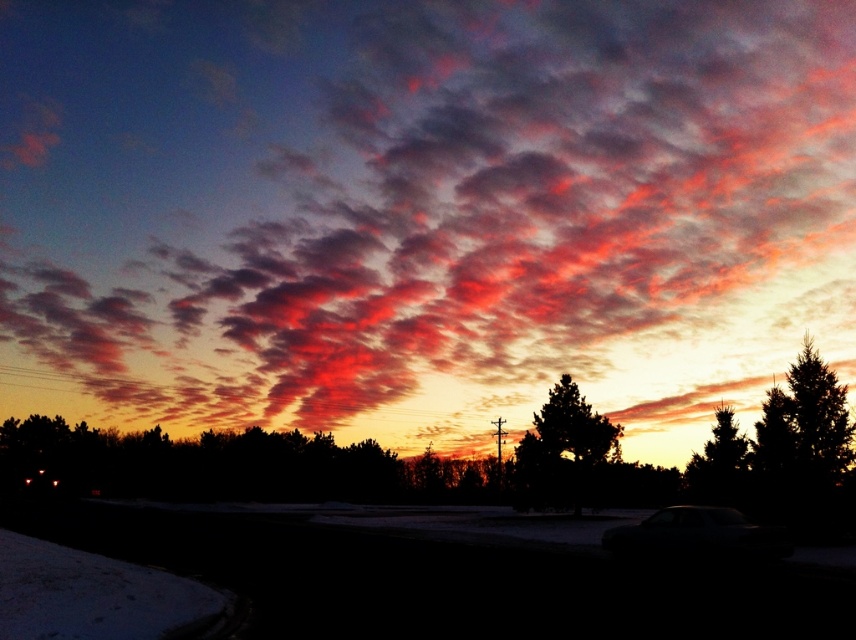
Question: Can you confirm if cloudy sky at upper center is positioned to the right of dark gray metallic car at lower right?

Choices:
 (A) yes
 (B) no

Answer: (B)

Question: Which object is positioned farthest from the cloudy sky at upper center?

Choices:
 (A) dark gray metallic car at lower right
 (B) dark green textured tree at center

Answer: (B)

Question: Can you confirm if cloudy sky at upper center is positioned below dark gray metallic car at lower right?

Choices:
 (A) yes
 (B) no

Answer: (B)

Question: Which point is farther from the camera taking this photo?

Choices:
 (A) (756, 554)
 (B) (728, 497)

Answer: (B)

Question: Which object is positioned farthest from the dark green textured tree at center?

Choices:
 (A) dark gray metallic car at lower right
 (B) green leafy tree at right
 (C) cloudy sky at upper center

Answer: (C)

Question: Is dark green textured tree at center closer to camera compared to green leafy tree at right?

Choices:
 (A) yes
 (B) no

Answer: (B)